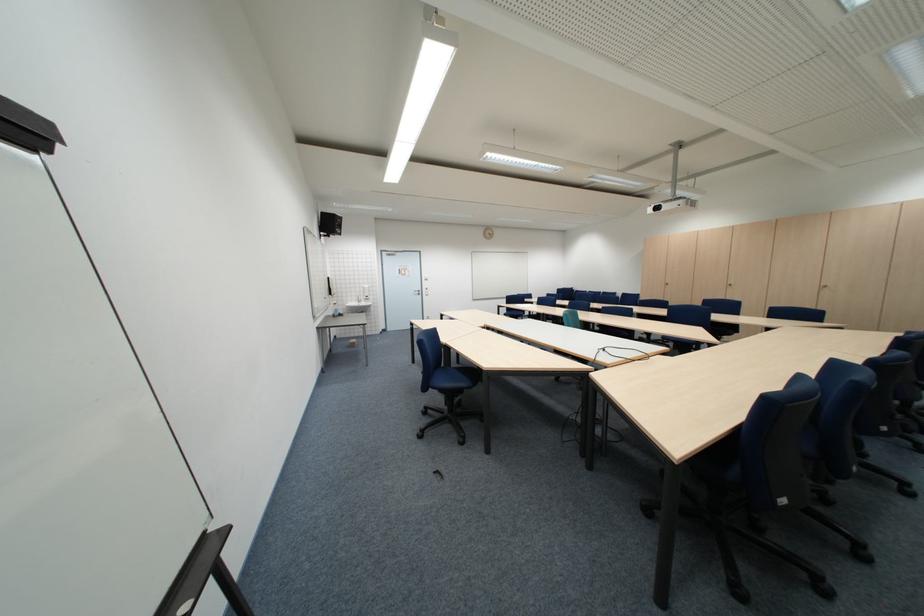
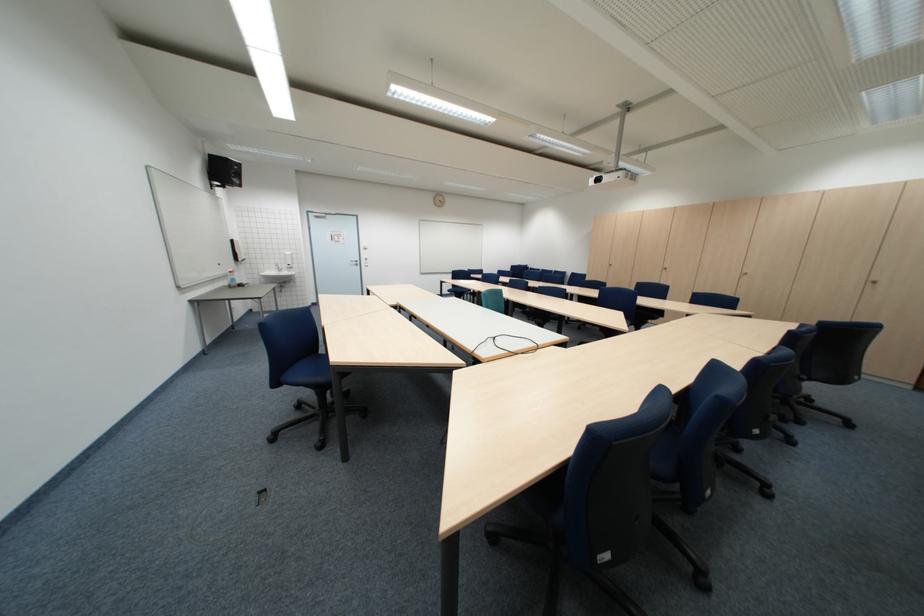
Question: How did the camera likely rotate?

Choices:
 (A) Left
 (B) Right
 (C) Up
 (D) Down

Answer: (B)